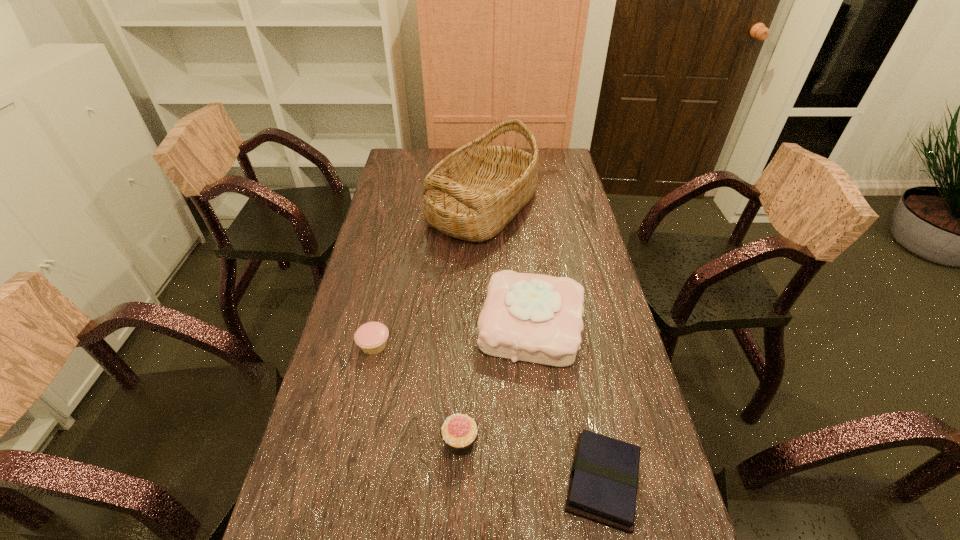
Where is `vacant space located on the back of the third tallest object`? The width and height of the screenshot is (960, 540). vacant space located on the back of the third tallest object is located at coordinates (463, 366).

Identify the location of free space located on the front of the farther cupcake. [x=335, y=523].

Image resolution: width=960 pixels, height=540 pixels. In order to click on free space located 0.150m on the back of the book in this screenshot , I will do `click(583, 381)`.

Where is `object at the far edge`? object at the far edge is located at coordinates (472, 194).

This screenshot has width=960, height=540. I want to click on object located in the left edge section of the desktop, so click(371, 337).

What are the coordinates of `cake situated at the right edge` in the screenshot? It's located at (537, 318).

Where is `book that is at the right edge`? This screenshot has height=540, width=960. book that is at the right edge is located at coordinates (603, 485).

In the image, there is a desktop. Identify the location of vacant space at the left edge. The width and height of the screenshot is (960, 540). (387, 256).

Image resolution: width=960 pixels, height=540 pixels. Identify the location of vacant point at the right edge. (644, 492).

This screenshot has width=960, height=540. I want to click on vacant space at the far left corner of the desktop, so click(x=406, y=168).